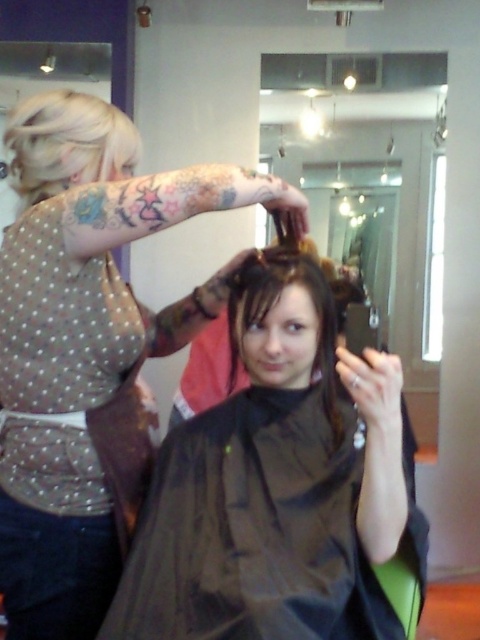
You are a customer in the hair salon and want to know which of the two points, point (143, 563) or point (105, 160), is nearer to you. Can you determine this based on the scene?

Point (143, 563) is closer to the viewer than point (105, 160), so the first point is nearer to you.

You are a robotic stylist in a hair salon. You need to adjust the height of your arm to reach the shiny black hair at center. Your arm can extend up to 1.2 meters. Can your arm reach the hair?

The shiny black hair at center is 1.11 meters away from the camera, so yes, the robotic stylist can reach it since their arm can extend up to 1.2 meters, which is longer than the required distance.

You are a customer in the salon and want to ask about the hairstyle of the person with the shiny black hair at center. However, you notice another person with blonde shiny hair at upper left. Which hairstyle should you ask about first if you want to discuss the one closer to the top of the image?

The blonde shiny hair at upper left is closer to the top of the image, so you should ask about that one first.